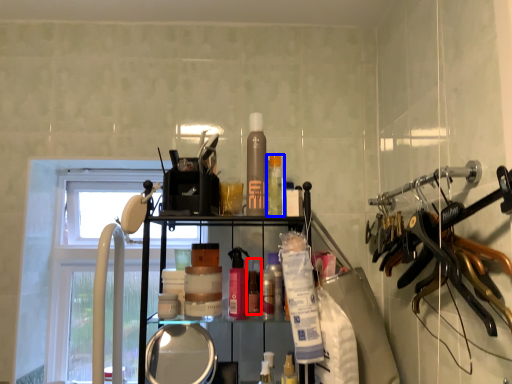
Question: Which of the following is the farthest to the observer, toiletry (highlighted by a red box) or toiletry (highlighted by a blue box)?

Choices:
 (A) toiletry
 (B) toiletry

Answer: (A)